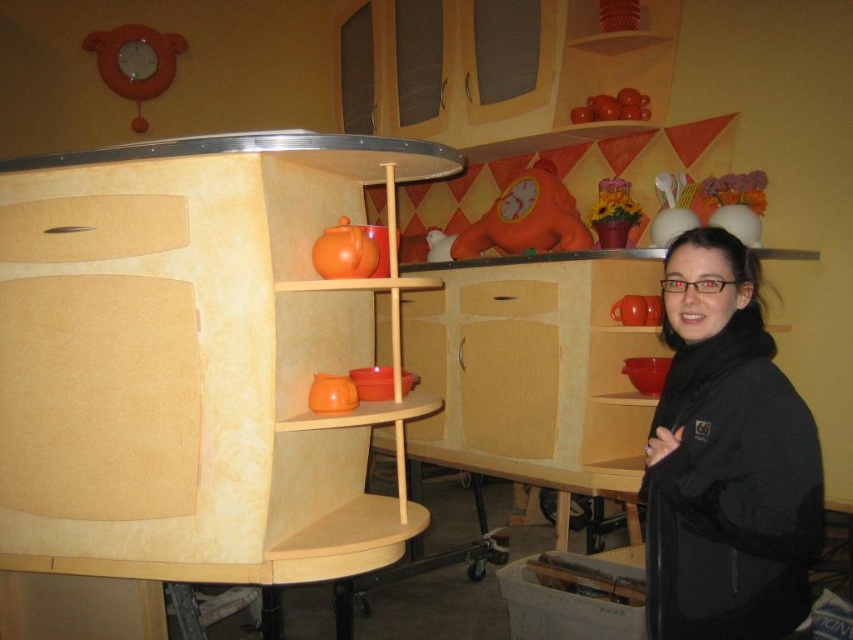
You are organizing a childrens party and need to place the black soft jacket at right and the white cardboard box at lower center. According to the scene, which object is closer to you?

The black soft jacket at right is closer to you because it is in front of the white cardboard box at lower center.

You are organizing a closet and need to decide where to place the black soft jacket at right and the white cardboard box at lower center. Given their sizes, which object should you place first in the limited space?

The black soft jacket at right is larger in size than the white cardboard box at lower center, so you should place the black soft jacket at right first to ensure it fits in the limited space.

You are organizing a childrens party in the kitchen and need to place a gift box. The gift box requires a spot that is not occupied by the black soft jacket at right. Where should you place the gift box?

The black soft jacket at right is located at point (726, 460), so you should place the gift box somewhere else in the kitchen not at that coordinate.